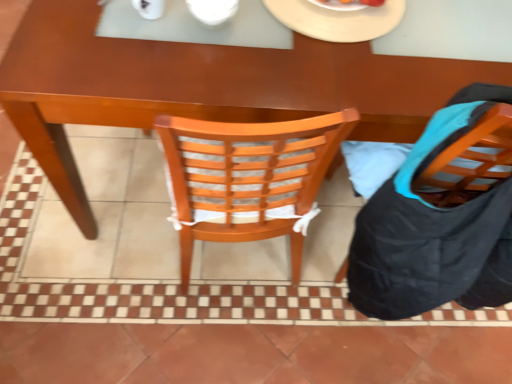
You are a GUI agent. You are given a task and a screenshot of the screen. Output one action in this format:
    pyautogui.click(x=<x>, y=<y>)
    Task: Click on the vacant space in front of white glossy bowl at upper center
    Image resolution: width=512 pixels, height=384 pixels.
    Given the screenshot: What is the action you would take?
    pyautogui.click(x=201, y=64)